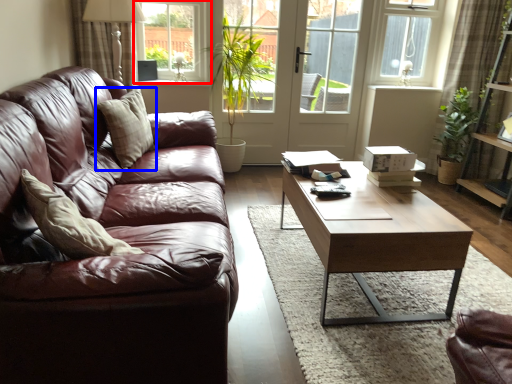
Question: Which object appears farthest to the camera in this image, window (highlighted by a red box) or pillow (highlighted by a blue box)?

Choices:
 (A) window
 (B) pillow

Answer: (A)